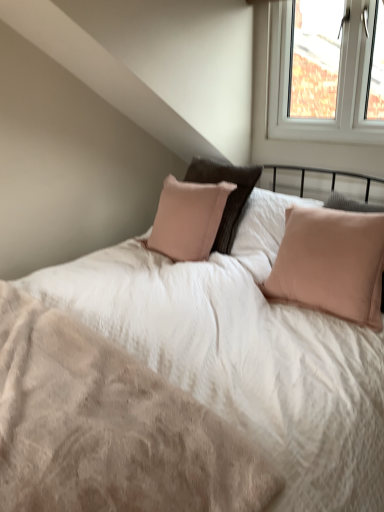
Question: Is point (56, 477) closer or farther from the camera than point (299, 242)?

Choices:
 (A) farther
 (B) closer

Answer: (B)

Question: Looking at the image, does beige soft fabric mattress at center seem bigger or smaller compared to pale pink fabric pillow at right?

Choices:
 (A) small
 (B) big

Answer: (A)

Question: Which is farther from the pale pink fabric pillow at right?

Choices:
 (A) beige soft fabric mattress at center
 (B) white plastic window at upper right

Answer: (B)

Question: Estimate the real-world distances between objects in this image. Which object is closer to the pale pink fabric pillow at right?

Choices:
 (A) beige soft fabric mattress at center
 (B) white plastic window at upper right

Answer: (A)